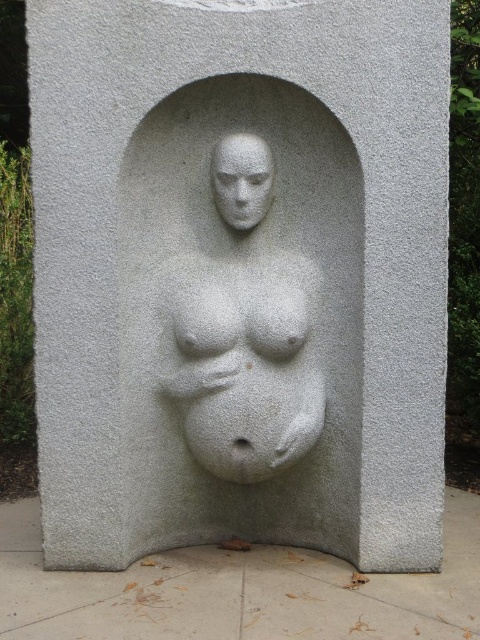
You are an art conservator examining the sculpture. You notice the gray rough concrete at lower center and the white textured stone pregnant figure at center. Which material is closer to the viewer?

The gray rough concrete at lower center is in front of the white textured stone pregnant figure at center, so it is closer to the viewer.

You are an archaeologist examining the stone sculpture. You notice two points marked on the structure. The first point is at coordinate point (200,621) and the second is at point (218,166). Which point is closer to the viewer?

Point (200,621) is in front of point (218,166), so the first point is closer to the viewer.

You are a construction worker who needs to place a 6.5 feet long steel beam between the gray rough concrete at lower center and the stone sculpture embedded within a larger stone structure. Is there enough space to fit the beam without bending it?

The distance between the gray rough concrete at lower center and the stone sculpture embedded within a larger stone structure is 7.05 feet. Since the steel beam is 6.5 feet long, there is sufficient space to place it without bending.